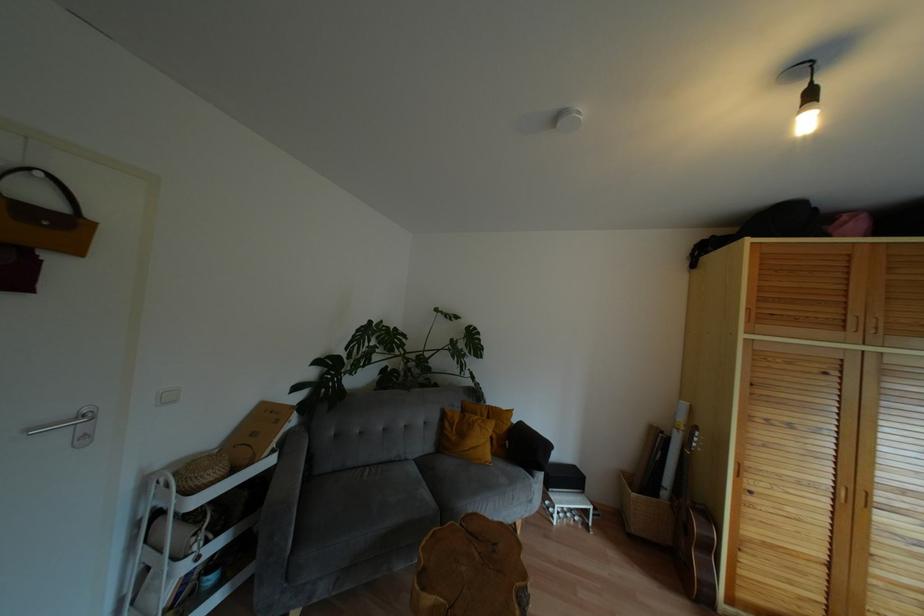
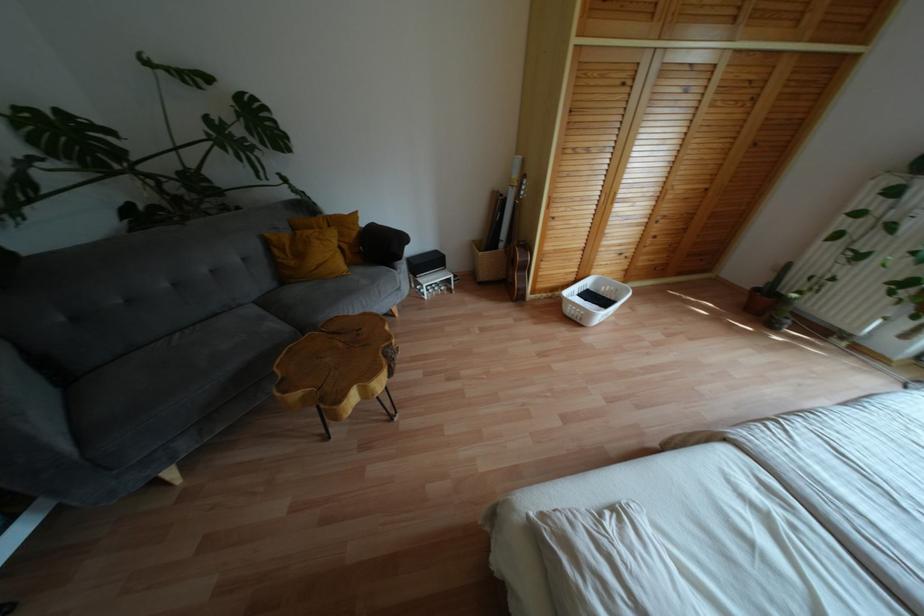
The point at (488, 456) is marked in the first image. Where is the corresponding point in the second image?

(343, 267)